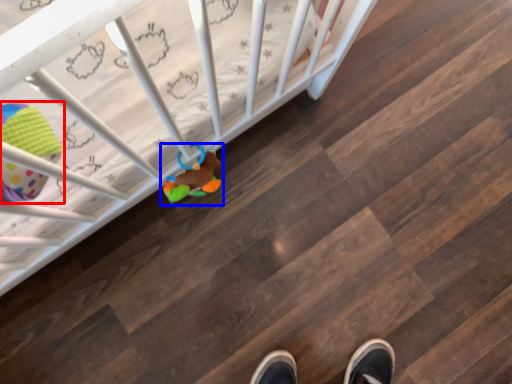
Question: Among these objects, which one is farthest to the camera, toy (highlighted by a red box) or toy (highlighted by a blue box)?

Choices:
 (A) toy
 (B) toy

Answer: (B)